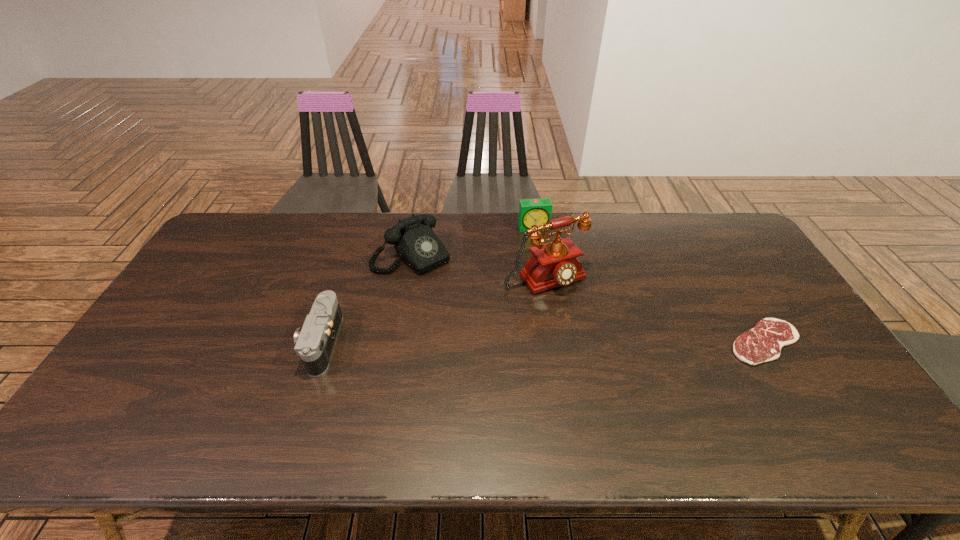
Locate an element on the screen. The image size is (960, 540). the leftmost object is located at coordinates (314, 342).

In order to click on steak in this screenshot , I will do (763, 343).

Locate an element on the screen. the shortest object is located at coordinates (763, 343).

Image resolution: width=960 pixels, height=540 pixels. What are the coordinates of `the shorter telephone` in the screenshot? It's located at (415, 242).

Identify the location of the second object from left to right. (x=415, y=242).

This screenshot has width=960, height=540. Find the location of `alarm clock`. alarm clock is located at coordinates (531, 211).

Find the location of a particular element. The image size is (960, 540). the right telephone is located at coordinates (553, 264).

What are the coordinates of `the tallest object` in the screenshot? It's located at (553, 264).

The height and width of the screenshot is (540, 960). Identify the location of vacant space situated 0.380m on the lens of the camera. (165, 343).

Where is `vacant space located 0.400m on the lens of the camera`? vacant space located 0.400m on the lens of the camera is located at coordinates (158, 343).